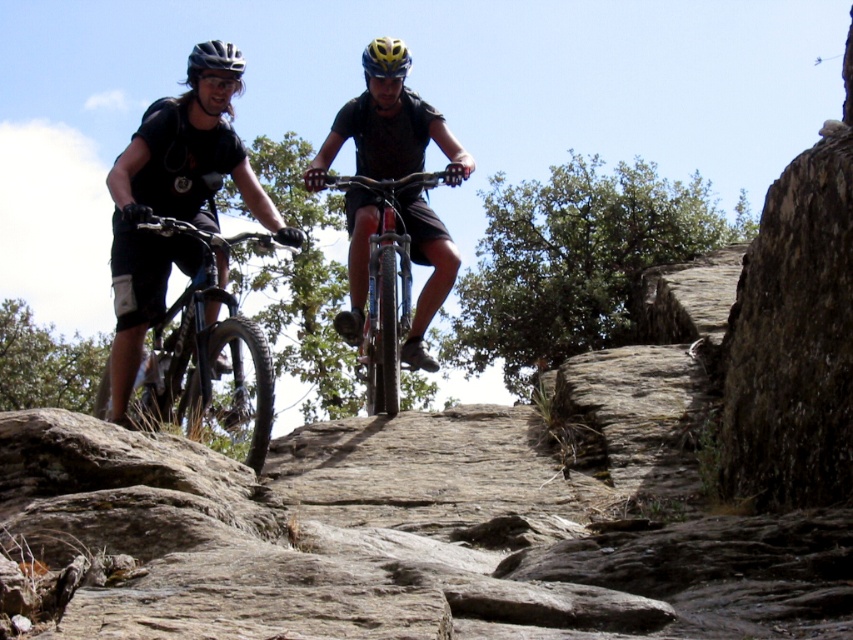
Is shiny black bike at left positioned behind shiny metallic bicycle at center?

No, it is not.

Who is higher up, shiny black bike at left or shiny metallic bicycle at center?

shiny metallic bicycle at center

Is point (154, 230) positioned after point (370, 289)?

No, (154, 230) is in front of (370, 289).

Locate an element on the screen. The width and height of the screenshot is (853, 640). shiny black bike at left is located at coordinates (x=207, y=356).

Who is shorter, shiny metallic bicycle at center or matte black helmet at upper left?

Standing shorter between the two is shiny metallic bicycle at center.

The width and height of the screenshot is (853, 640). In order to click on shiny metallic bicycle at center in this screenshot , I will do `click(387, 285)`.

Is point (378, 292) more distant than point (212, 56)?

Yes, point (378, 292) is behind point (212, 56).

The image size is (853, 640). What are the coordinates of `shiny metallic bicycle at center` in the screenshot? It's located at (387, 285).

Based on the photo, who is more forward, [248,408] or [221,67]?

Point [248,408]

Where is `shiny black bike at left`? This screenshot has width=853, height=640. shiny black bike at left is located at coordinates (207, 356).